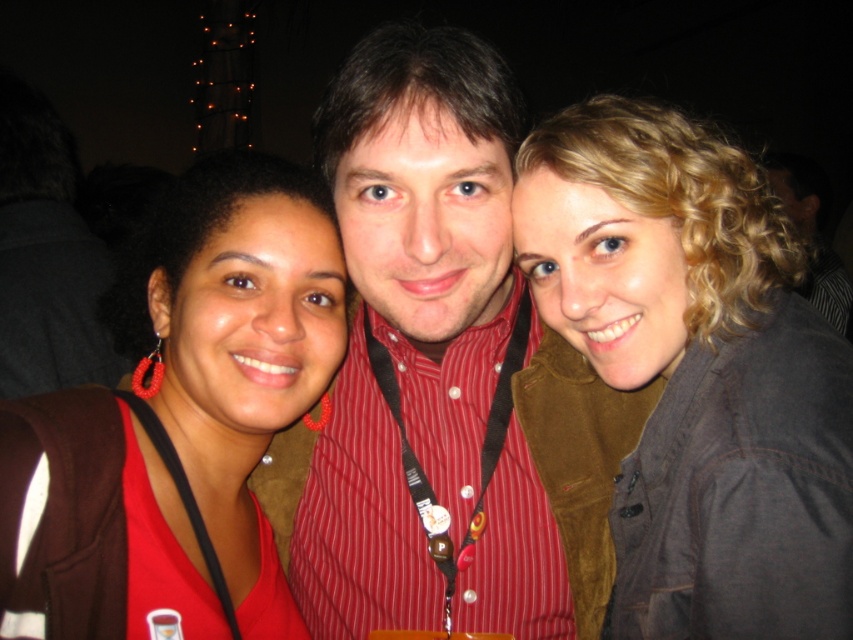
Question: Which object is positioned closest to the matte red earrings at center?

Choices:
 (A) blonde curly hair at upper right
 (B) red striped shirt at center

Answer: (B)

Question: Is red striped shirt at center closer to the viewer compared to matte red earrings at center?

Choices:
 (A) no
 (B) yes

Answer: (A)

Question: Can you confirm if blonde curly hair at upper right is positioned to the left of matte red earrings at center?

Choices:
 (A) yes
 (B) no

Answer: (B)

Question: Which is farther from the red striped shirt at center?

Choices:
 (A) matte red earrings at center
 (B) blonde curly hair at upper right

Answer: (B)

Question: Which object is the farthest from the blonde curly hair at upper right?

Choices:
 (A) matte red earrings at center
 (B) red striped shirt at center

Answer: (A)

Question: Is red striped shirt at center closer to camera compared to matte red earrings at center?

Choices:
 (A) yes
 (B) no

Answer: (B)